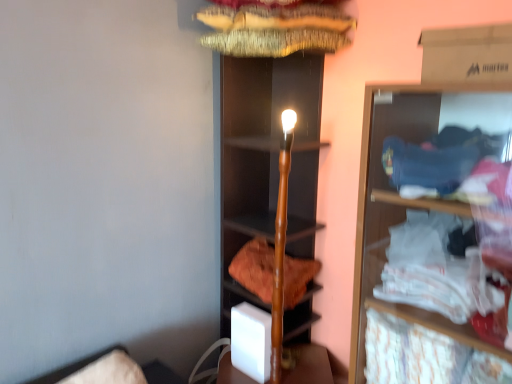
This screenshot has width=512, height=384. What do you see at coordinates (255, 268) in the screenshot?
I see `orange cotton towel at center` at bounding box center [255, 268].

The height and width of the screenshot is (384, 512). In order to click on orange cotton towel at center in this screenshot , I will do `click(255, 268)`.

Find the location of `orange cotton towel at center`. orange cotton towel at center is located at coordinates (255, 268).